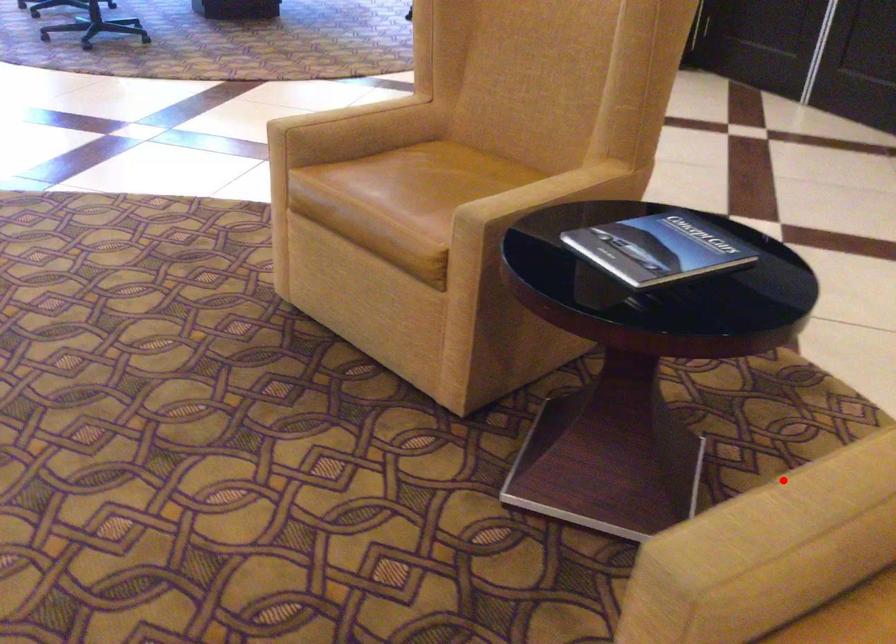
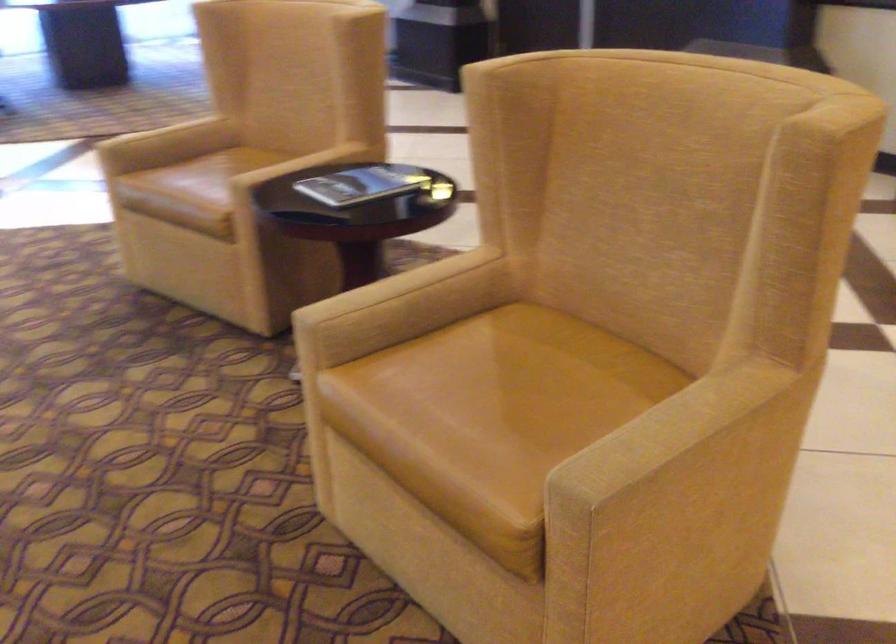
Question: I am providing you with two images of the same scene from different viewpoints. Image1 has a red point marked. In image2, the corresponding 3D location appears at what relative position? Reply with the corresponding letter.

Choices:
 (A) Closer
 (B) Farther

Answer: (B)